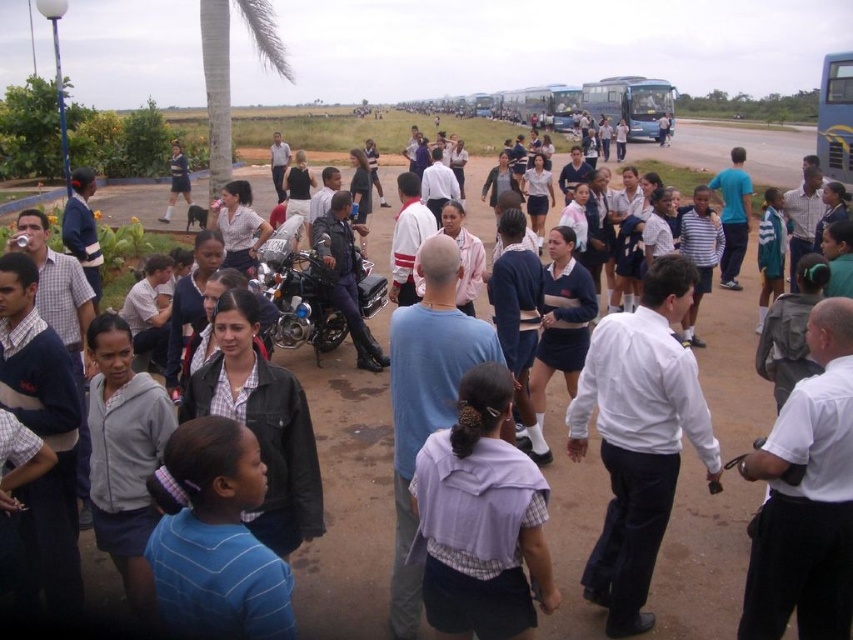
Question: Can you confirm if purple fabric shirt at center is positioned above leather jacket at center?

Choices:
 (A) yes
 (B) no

Answer: (B)

Question: Which point is farther from the camera taking this photo?

Choices:
 (A) (207, 106)
 (B) (628, 136)
 (C) (666, 428)
 (D) (498, 476)

Answer: (B)

Question: Does leather jacket at center appear under blue metallic bus at upper center?

Choices:
 (A) no
 (B) yes

Answer: (B)

Question: Is green textured palm tree at upper left smaller than leather jacket at center?

Choices:
 (A) yes
 (B) no

Answer: (B)

Question: Estimate the real-world distances between objects in this image. Which object is farther from the white shirt at center?

Choices:
 (A) leather jacket at center
 (B) blue metallic bus at upper center
 (C) green textured palm tree at upper left
 (D) purple fabric shirt at center

Answer: (B)

Question: Estimate the real-world distances between objects in this image. Which object is farther from the blue metallic bus at upper center?

Choices:
 (A) leather jacket at center
 (B) purple fabric shirt at center
 (C) white shirt at center

Answer: (C)